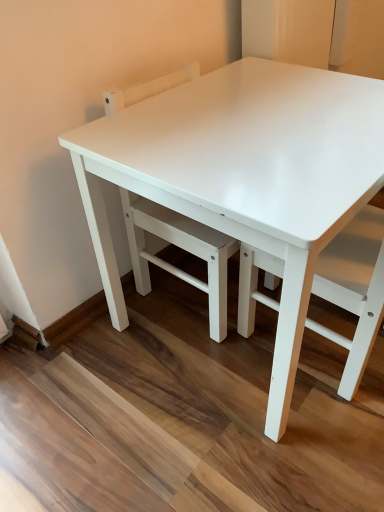
Where is `white matte chair at center`? Image resolution: width=384 pixels, height=512 pixels. white matte chair at center is located at coordinates (354, 289).

Find the location of a particular element. The image size is (384, 512). white matte chair at center is located at coordinates (354, 289).

Considering the relative sizes of white glossy table at center and white matte chair at center in the image provided, is white glossy table at center wider than white matte chair at center?

Indeed, white glossy table at center has a greater width compared to white matte chair at center.

Could you tell me if white glossy table at center is facing white matte chair at center?

Yes, white glossy table at center is facing white matte chair at center.

In the scene shown: Which object is positioned more to the left, white glossy table at center or white matte chair at center?

From the viewer's perspective, white glossy table at center appears more on the left side.

From the image's perspective, is white glossy table at center located above or below white matte chair at center?

Based on their image positions, white glossy table at center is located above white matte chair at center.

In the scene shown: How different are the orientations of white glossy table top at center and white matte chair at center in degrees?

180 degrees.

From a real-world perspective, is white glossy table top at center located beneath white matte chair at center?

No, from a real-world perspective, white glossy table top at center is not under white matte chair at center.

Does point (288, 93) come behind point (316, 282)?

Yes, point (288, 93) is farther from viewer.

Between white matte chair at center and white glossy table at center, which one has smaller size?

Smaller between the two is white matte chair at center.

Would you consider white matte chair at center to be distant from white glossy table at center?

They are positioned close to each other.

Can you tell me how much white matte chair at center and white glossy table at center differ in facing direction?

180 degrees separate the facing orientations of white matte chair at center and white glossy table at center.

Is white matte chair at center situated inside white glossy table at center or outside?

white matte chair at center fits inside white glossy table at center.

How far apart are white glossy table at center and white glossy table top at center?

A distance of 1.78 centimeters exists between white glossy table at center and white glossy table top at center.

Consider the image. Is white glossy table at center in contact with white glossy table top at center?

Yes, white glossy table at center is in contact with white glossy table top at center.

Is the position of white glossy table at center less distant than that of white glossy table top at center?

Yes.

From a real-world perspective, is white glossy table top at center over white glossy table at center?

Indeed, from a real-world perspective, white glossy table top at center stands above white glossy table at center.

Based on the photo, from the image's perspective, is white glossy table top at center above or below white glossy table at center?

From the image's perspective, white glossy table top at center appears above white glossy table at center.

Considering the relative sizes of white glossy table top at center and white glossy table at center in the image provided, is white glossy table top at center shorter than white glossy table at center?

Correct, white glossy table top at center is not as tall as white glossy table at center.

Is white glossy table top at center in front of or behind white glossy table at center in the image?

white glossy table top at center is behind white glossy table at center.

Which object is further away from the camera, white matte chair at center or white glossy table top at center?

white glossy table top at center is behind.

Between white matte chair at center and white glossy table top at center, which one has more height?

With more height is white matte chair at center.

Is white matte chair at center facing towards white glossy table top at center?

Yes.

From the image's perspective, is white matte chair at center over white glossy table top at center?

No.

Find the location of a particular element. The image size is (384, 512). table in front of the white matte chair at center is located at coordinates (245, 175).

Where is `table top lying above the white matte chair at center (from the image's perspective)`? This screenshot has height=512, width=384. table top lying above the white matte chair at center (from the image's perspective) is located at coordinates (253, 151).

Based on their spatial positions, is white glossy table top at center or white matte chair at center closer to white glossy table at center?

white glossy table top at center is positioned closer to the anchor white glossy table at center.

When comparing their distances from white matte chair at center, does white glossy table at center or white glossy table top at center seem closer?

Among the two, white glossy table at center is located nearer to white matte chair at center.

Considering their positions, is white matte chair at center positioned closer to white glossy table at center than white glossy table top at center?

white glossy table top at center is positioned closer to the anchor white glossy table at center.

Which object lies further to the anchor point white matte chair at center, white glossy table top at center or white glossy table at center?

Among the two, white glossy table top at center is located further to white matte chair at center.

Consider the image. Which object lies further to the anchor point white glossy table top at center, white glossy table at center or white matte chair at center?

Based on the image, white matte chair at center appears to be further to white glossy table top at center.

Looking at the image, which one is located closer to white glossy table top at center, white matte chair at center or white glossy table at center?

white glossy table at center.

Identify the location of table situated between white glossy table top at center and white matte chair at center from left to right. (245, 175).